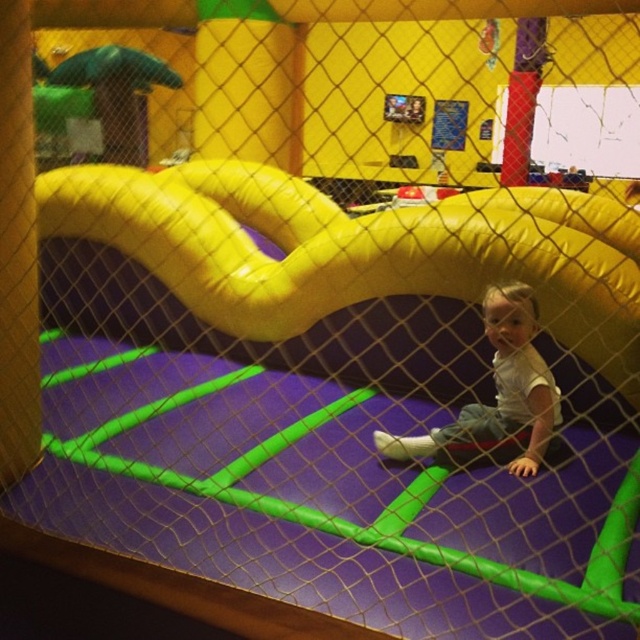
Question: Which of the following is the farthest from the observer?

Choices:
 (A) yellow inflatable slide at center
 (B) white matte shirt at center

Answer: (A)

Question: Which of the following is the closest to the observer?

Choices:
 (A) click(x=285, y=192)
 (B) click(x=531, y=428)

Answer: (B)

Question: Which point appears closest to the camera in this image?

Choices:
 (A) (522, 348)
 (B) (385, 280)

Answer: (A)

Question: Does yellow inflatable slide at center have a smaller size compared to white matte shirt at center?

Choices:
 (A) yes
 (B) no

Answer: (B)

Question: Does yellow inflatable slide at center appear on the left side of white matte shirt at center?

Choices:
 (A) yes
 (B) no

Answer: (A)

Question: Does yellow inflatable slide at center appear over white matte shirt at center?

Choices:
 (A) yes
 (B) no

Answer: (A)